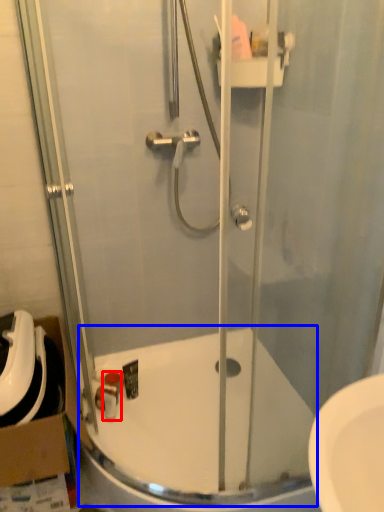
Question: Which object appears farthest to the camera in this image, toiletry (highlighted by a red box) or bath (highlighted by a blue box)?

Choices:
 (A) toiletry
 (B) bath

Answer: (A)